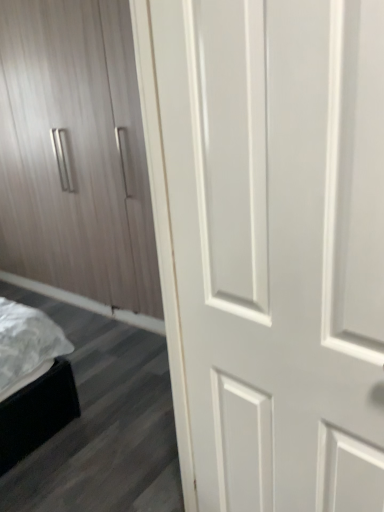
This screenshot has width=384, height=512. Describe the element at coordinates (270, 244) in the screenshot. I see `white glossy door at center` at that location.

The width and height of the screenshot is (384, 512). In order to click on white glossy door at center in this screenshot , I will do `click(270, 244)`.

Where is `white glossy door at center`? This screenshot has width=384, height=512. white glossy door at center is located at coordinates (270, 244).